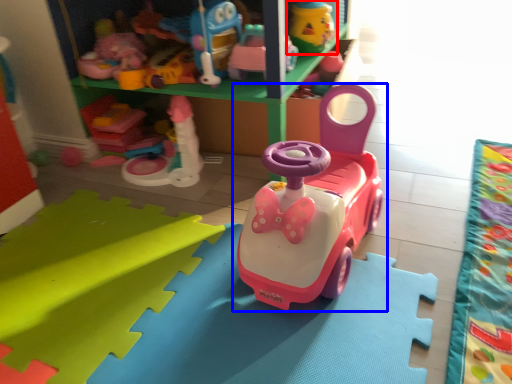
Question: Which of the following is the farthest to the observer, toy (highlighted by a red box) or toy (highlighted by a blue box)?

Choices:
 (A) toy
 (B) toy

Answer: (A)